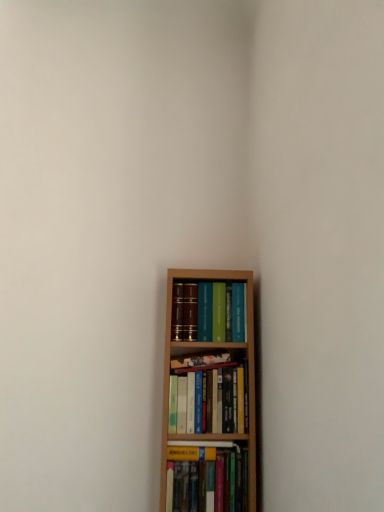
Question: Based on their positions, is hardcover books at center, arranged as the 2th book when ordered from the bottom, located to the left or right of matte hardcover books at center, the fourth book in the bottom-to-top sequence?

Choices:
 (A) left
 (B) right

Answer: (A)

Question: Is hardcover books at center, arranged as the third book when viewed from the top, wider or thinner than matte hardcover books at center, marked as the first book in a top-to-bottom arrangement?

Choices:
 (A) thin
 (B) wide

Answer: (A)

Question: Based on their relative distances, which object is nearer to the hardcover book at lower center, which is the 1th book in bottom-to-top order?

Choices:
 (A) hardcover books at center, arranged as the third book when viewed from the top
 (B) hardcover book at center, which ranks as the 3th book in bottom-to-top order
 (C) matte hardcover books at center, marked as the first book in a top-to-bottom arrangement

Answer: (A)

Question: Based on their relative distances, which object is nearer to the matte hardcover books at center, the fourth book in the bottom-to-top sequence?

Choices:
 (A) hardcover books at center, arranged as the third book when viewed from the top
 (B) hardcover book at center, which ranks as the 3th book in bottom-to-top order
 (C) hardcover book at lower center, the 4th book viewed from the top

Answer: (B)